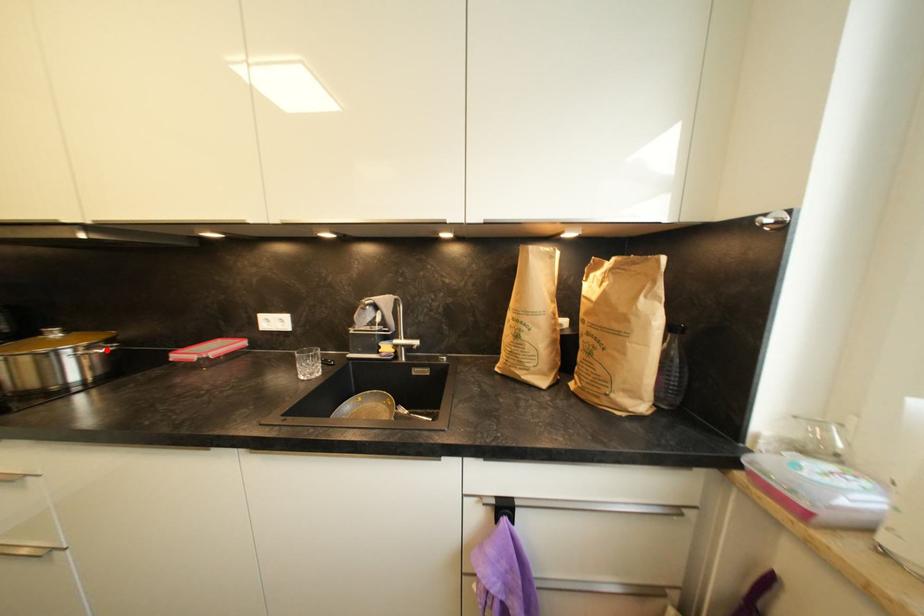
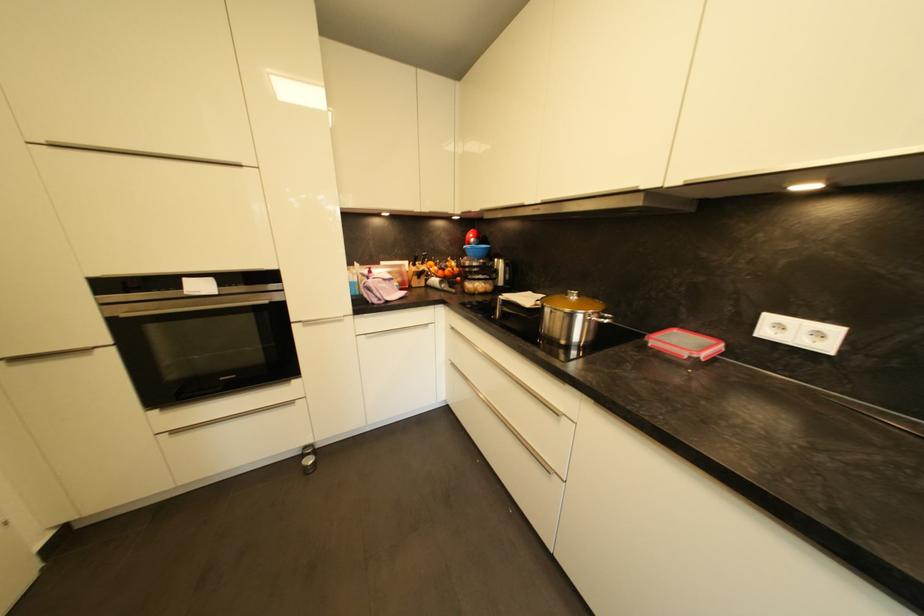
The point at the highlighted location is marked in the first image. Where is the corresponding point in the second image?

(610, 320)